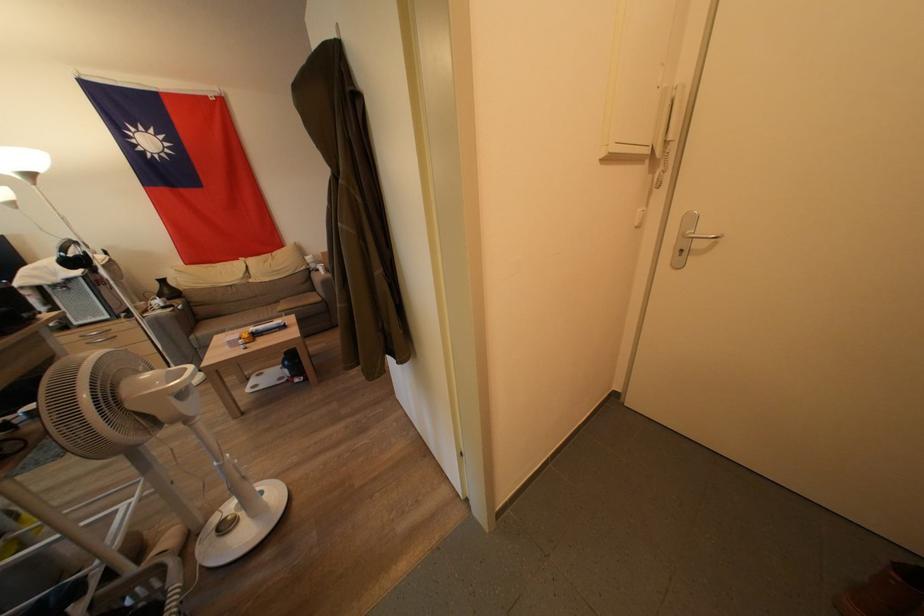
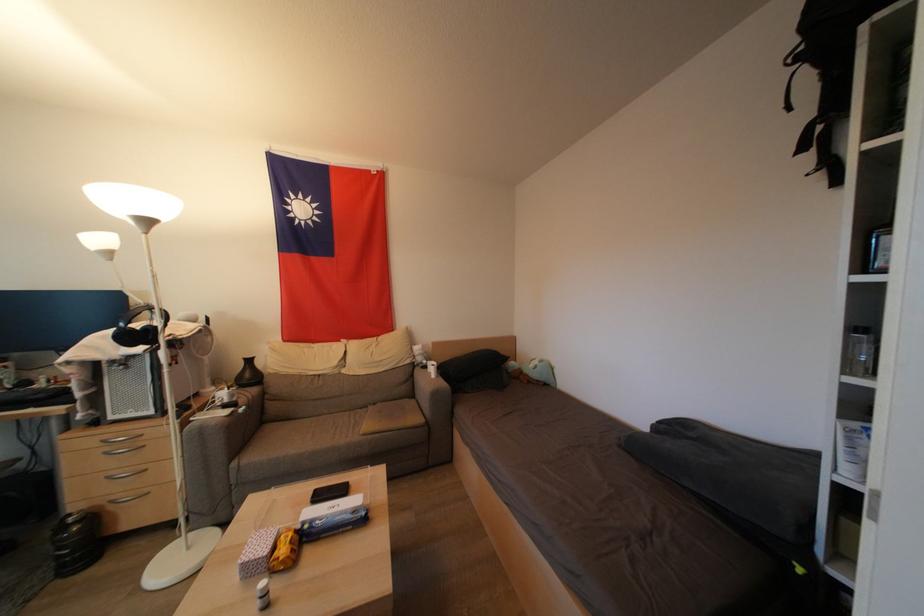
Find the pixel in the second image that matches (x=322, y=274) in the first image.

(430, 371)